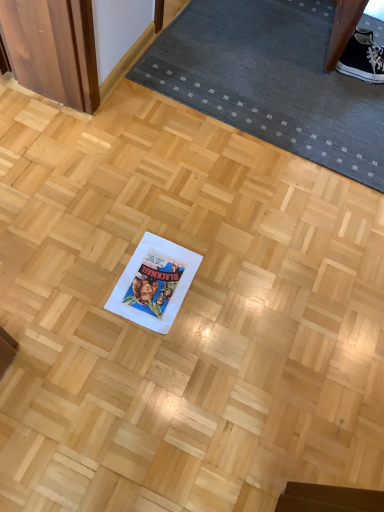
This screenshot has width=384, height=512. I want to click on dark gray textured mat at upper center, so click(x=271, y=80).

The width and height of the screenshot is (384, 512). What do you see at coordinates (271, 80) in the screenshot?
I see `dark gray textured mat at upper center` at bounding box center [271, 80].

Locate an element on the screen. dark gray textured mat at upper center is located at coordinates (271, 80).